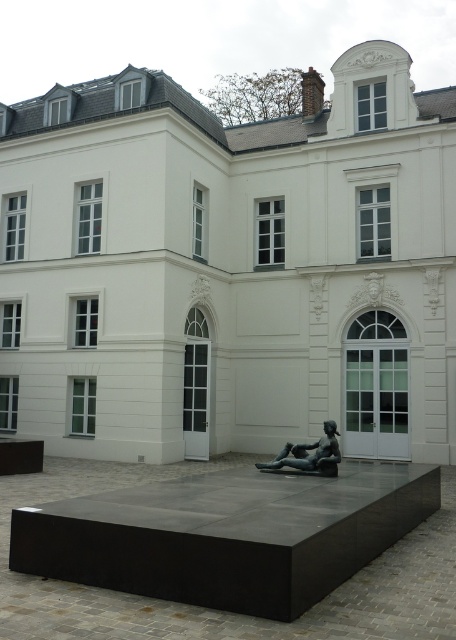
Between point (136, 412) and point (333, 424), which one is positioned behind?

The point (136, 412) is behind.

This screenshot has height=640, width=456. What do you see at coordinates (229, 268) in the screenshot?
I see `white smooth building at center` at bounding box center [229, 268].

Between point (279, 182) and point (290, 467), which one is positioned behind?

The point (279, 182) is more distant.

In order to click on white smooth building at center in this screenshot , I will do `click(229, 268)`.